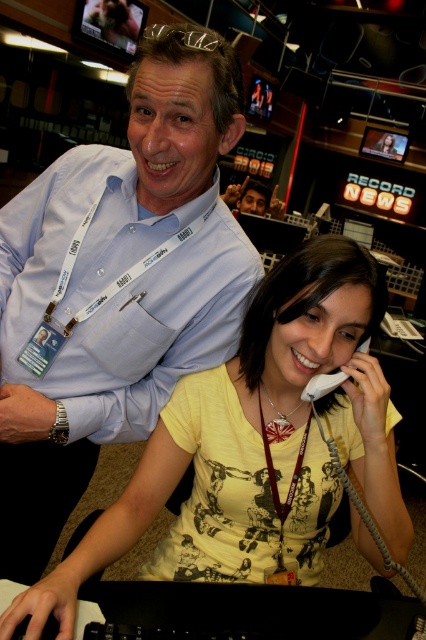
You are a technician in the newsroom who needs to adjust the settings on both the metallic glossy monitor at upper left and the matte plastic monitor at upper center. Which monitor should you approach first to reach the one closer to you?

The metallic glossy monitor at upper left is closer to the viewer, so you should approach it first.

You are a photographer standing in the newsroom scene. You need to take a photo of both the brown fabric lanyard at center and the matte black phone at upper center in the same frame. Given that your camera has a maximum focus range of 3 meters, will you be able to capture both objects clearly in the photo?

The brown fabric lanyard at center and matte black phone at upper center are 3.44 meters apart. Since the distance between them exceeds the camera maximum focus range of 3 meters, you will not be able to capture both objects clearly in the same frame.

You are an intern in the newsroom and need to locate the brown fabric lanyard at center and the matte black phone at upper center. Based on the scene description, which object is positioned lower in the image?

The brown fabric lanyard at center is positioned below the matte black phone at upper center, so the brown fabric lanyard at center is lower in the image.